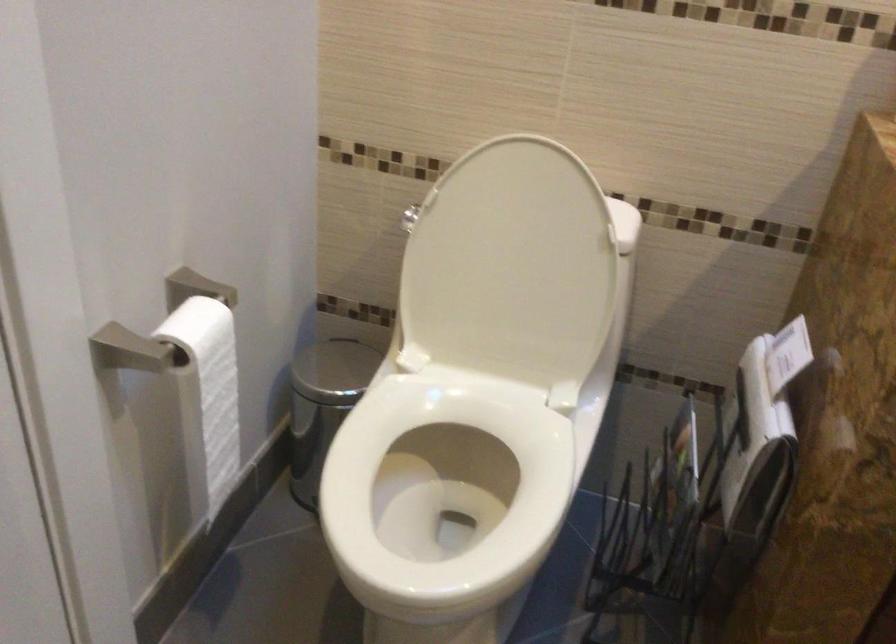
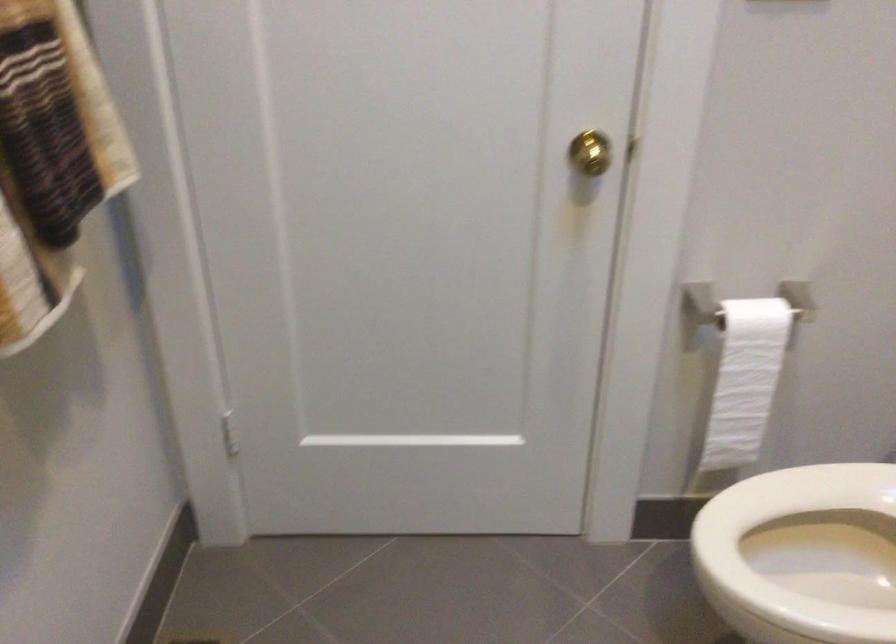
Question: How did the camera likely rotate?

Choices:
 (A) Left
 (B) Right
 (C) Up
 (D) Down

Answer: (A)